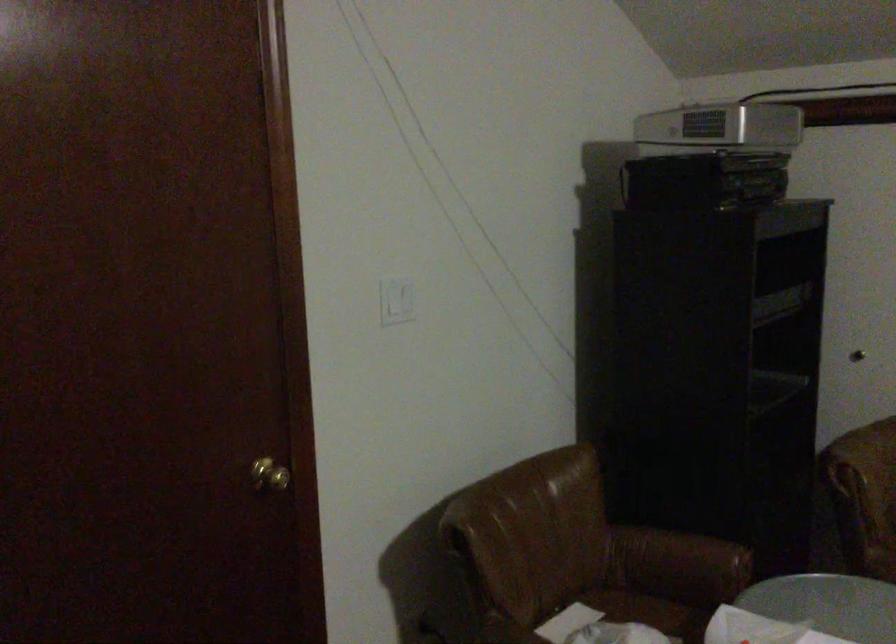
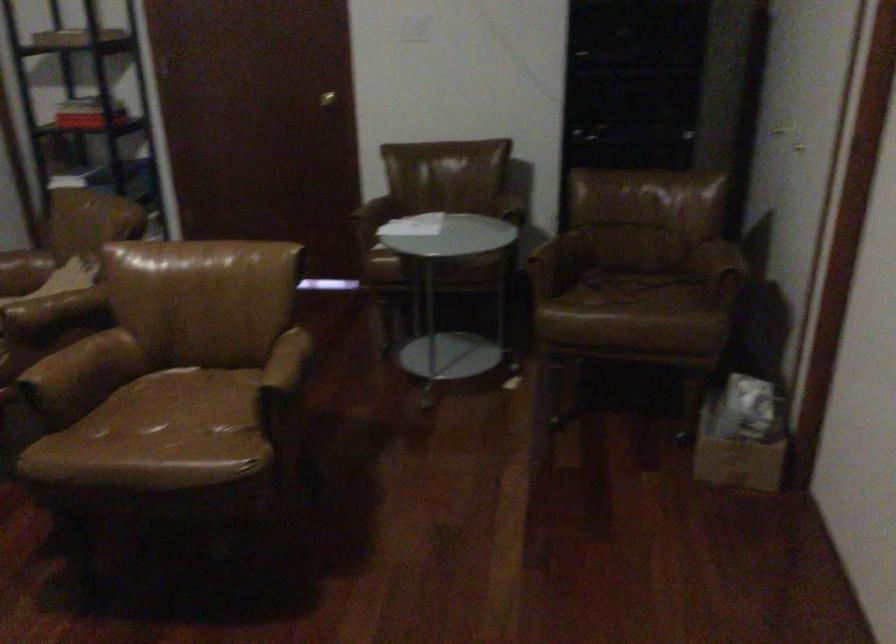
The point at (x=303, y=489) is marked in the first image. Where is the corresponding point in the second image?

(326, 99)